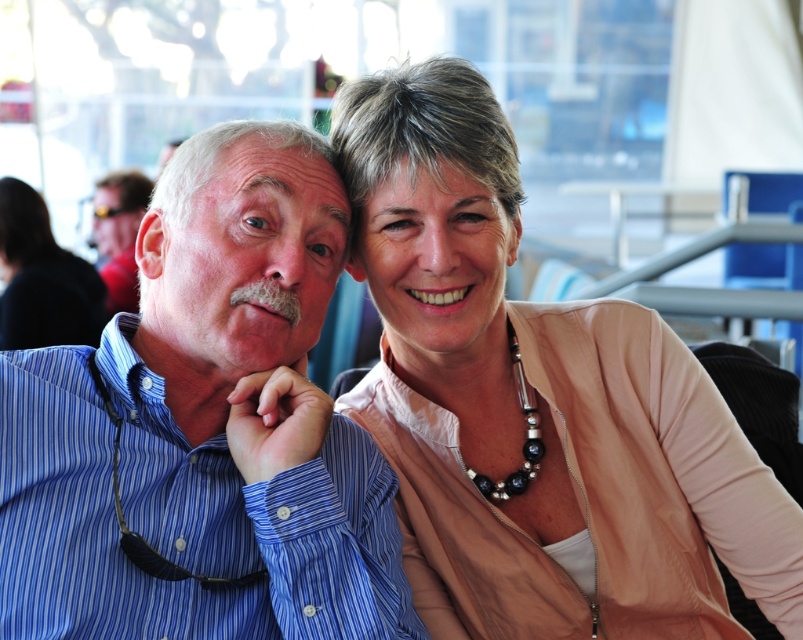
You are a photographer trying to capture a candid shot of both the blue striped shirt at left and the pale beige sweater at center without any obstruction. Based on their positions, which one might be partially hidden in the photo?

The blue striped shirt at left is behind the pale beige sweater at center, so the blue striped shirt at left might be partially hidden in the photo.

You are a photographer trying to capture a candid shot of the two people in the scene. Since the pale beige sweater at center and the matte blue shirt at left are partially overlapping, can you adjust your position to ensure both are fully visible without any obstruction?

The pale beige sweater at center is in front of the matte blue shirt at left, so moving to the side opposite the overlapping area would allow both to be seen without obstruction.